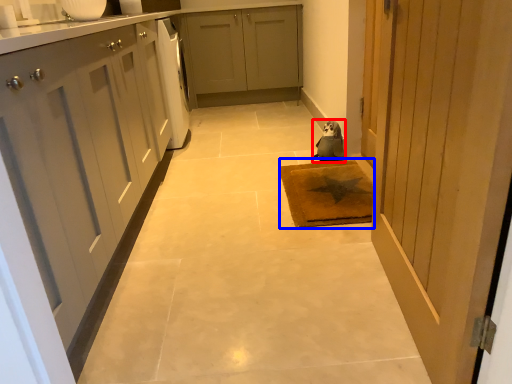
Question: Among these objects, which one is farthest to the camera, animal (highlighted by a red box) or mat (highlighted by a blue box)?

Choices:
 (A) animal
 (B) mat

Answer: (A)